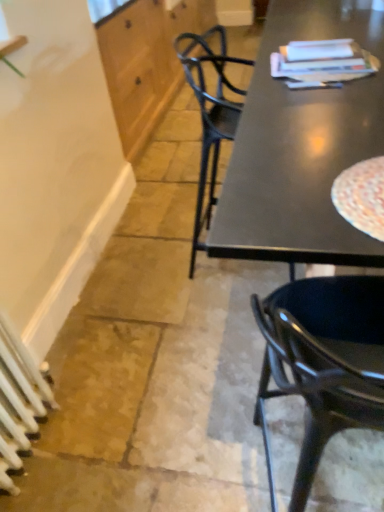
Find the location of `vacant point to the left of glossy black chair at right`. vacant point to the left of glossy black chair at right is located at coordinates (160, 453).